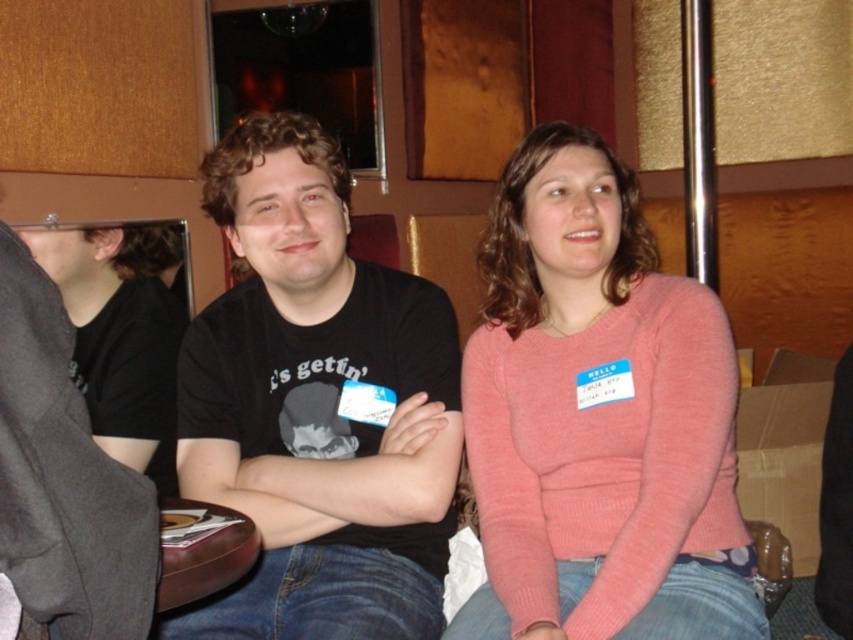
Question: Considering the real-world distances, which object is closest to the black matte t-shirt at center?

Choices:
 (A) pink knitted sweater at center
 (B) black matte shirt at left

Answer: (A)

Question: Is black matte t-shirt at center to the right of black matte shirt at left from the viewer's perspective?

Choices:
 (A) no
 (B) yes

Answer: (B)

Question: Which point is farther from the camera taking this photo?

Choices:
 (A) (448, 536)
 (B) (573, 321)
 (C) (155, 340)

Answer: (C)

Question: Observing the image, what is the correct spatial positioning of pink knitted sweater at center in reference to black matte shirt at left?

Choices:
 (A) left
 (B) right

Answer: (B)

Question: Which of the following is the farthest from the observer?

Choices:
 (A) black matte t-shirt at center
 (B) pink knitted sweater at center
 (C) black matte shirt at left

Answer: (C)

Question: Is the position of pink knitted sweater at center more distant than that of black matte shirt at left?

Choices:
 (A) yes
 (B) no

Answer: (B)